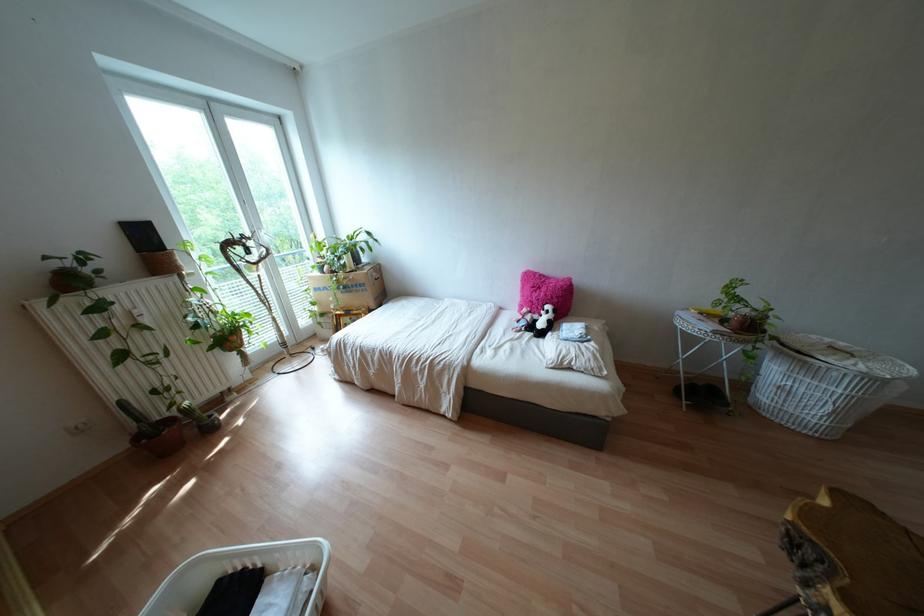
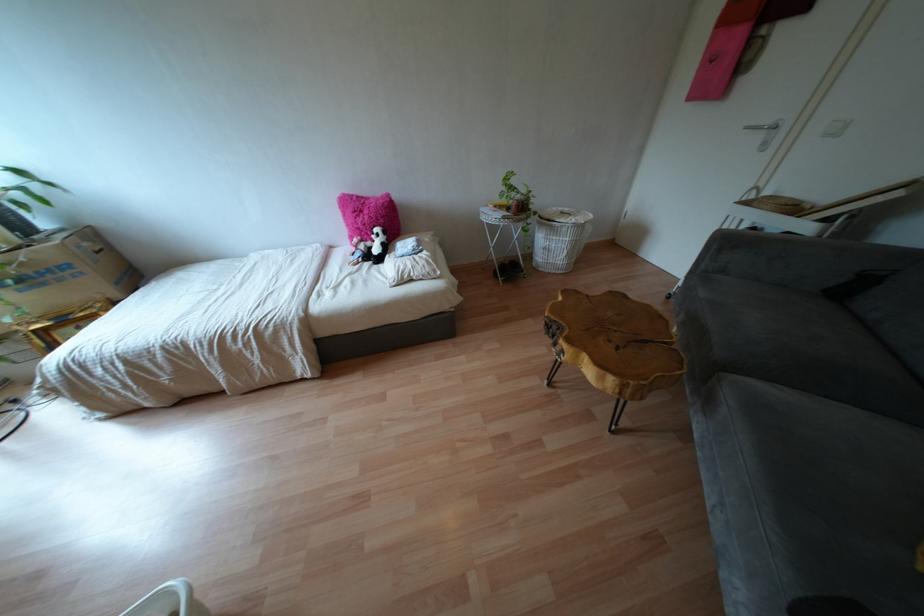
Where in the second image is the point corresponding to pixel 541 294 from the first image?

(365, 217)